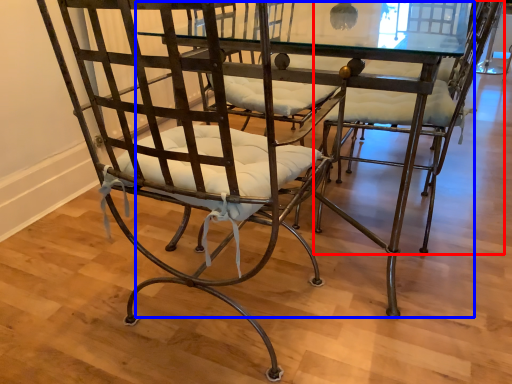
Question: Which object is closer to the camera taking this photo, chair (highlighted by a red box) or round table (highlighted by a blue box)?

Choices:
 (A) chair
 (B) round table

Answer: (B)